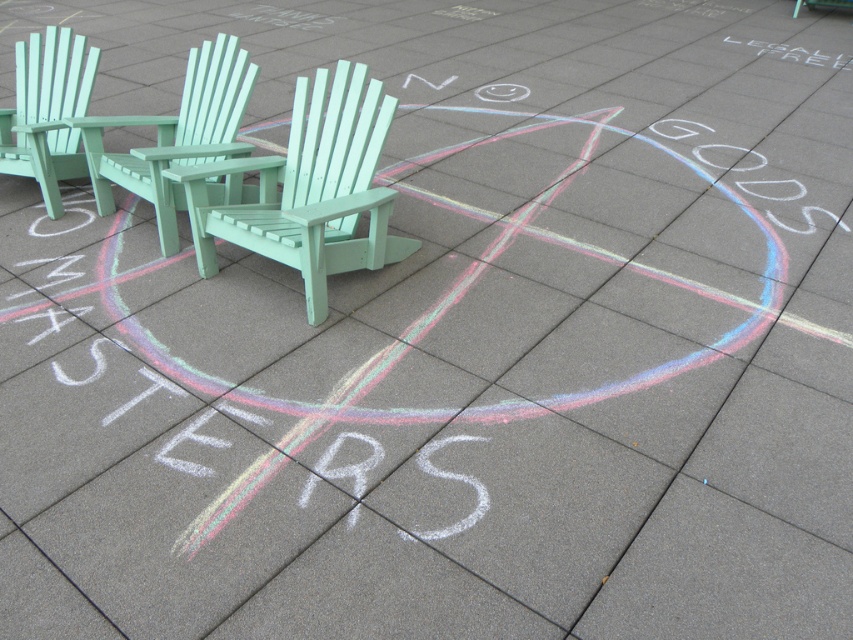
Question: Among these objects, which one is nearest to the camera?

Choices:
 (A) mint green plastic beach chair at center
 (B) mint green wood beach chair at center

Answer: (B)

Question: Does mint green plastic beach chair at center have a smaller size compared to mint green plastic chair at left?

Choices:
 (A) yes
 (B) no

Answer: (A)

Question: Can you confirm if mint green wood beach chair at center is bigger than mint green plastic beach chair at center?

Choices:
 (A) yes
 (B) no

Answer: (A)

Question: Among these points, which one is farthest from the camera?

Choices:
 (A) (402, 257)
 (B) (56, 168)

Answer: (B)

Question: Estimate the real-world distances between objects in this image. Which object is farther from the white chalk circle at lower left?

Choices:
 (A) mint green wood beach chair at center
 (B) white chalk smiley face at center
 (C) mint green plastic chair at left
 (D) mint green plastic beach chair at center

Answer: (B)

Question: Is mint green plastic chair at left below white chalk circle at lower left?

Choices:
 (A) no
 (B) yes

Answer: (A)